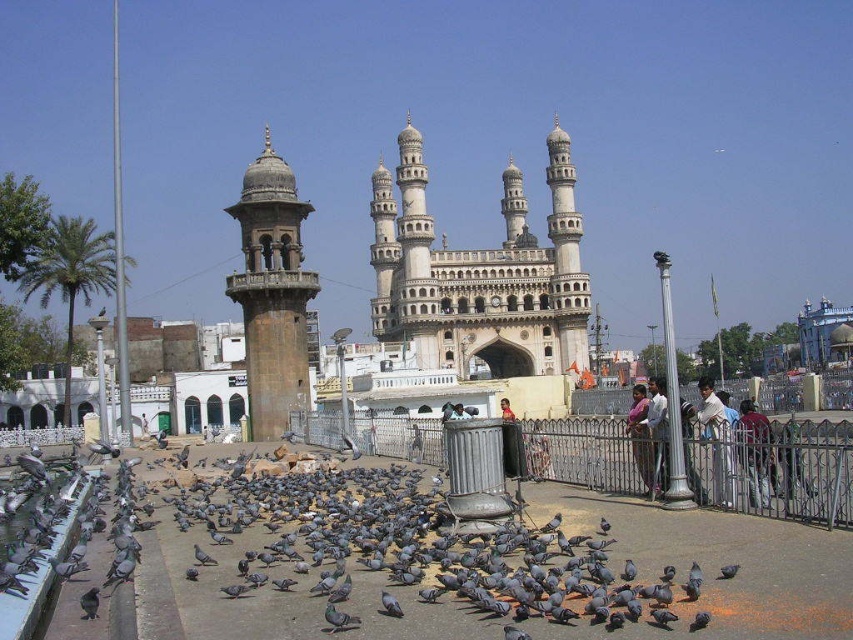
You are standing at the entrance of the mosque and want to feed pigeons. There are two points marked on the ground where you can throw food. The first point is at coordinate point(631, 433) and the second is at point(706, 384). Which point is closer to you?

Point(631, 433) is in front of point(706, 384), so it is closer to you.

You are standing in the public square looking at the mosque. There are two points marked on the ground where pigeons are feeding. One is at point (519, 326) and the other at point (735, 508). Which point is closer to you?

Point (519, 326) is closer to you because it is further to the viewer than point (735, 508).

In the scene shown: You are a tourist standing in front of the stone carved archway at center and the silver metallic fence at center in the plaza. You want to take a photo that includes both objects in the frame. Which object should you focus on to ensure both are visible?

The stone carved archway at center is positioned over the silver metallic fence at center, so focusing on the archway will allow both objects to be visible in the photo.